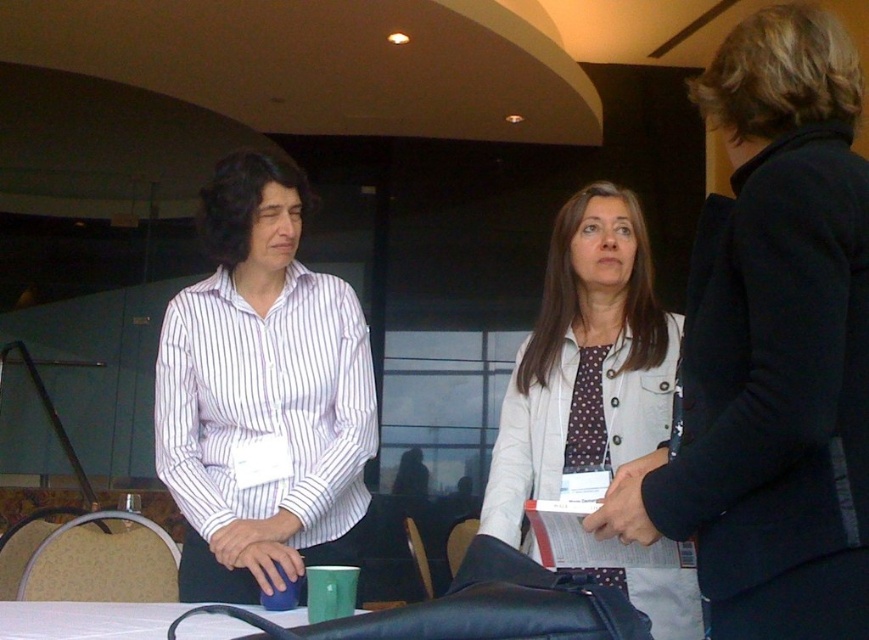
Is white textured jacket at center to the right of white glossy table at lower center from the viewer's perspective?

Correct, you'll find white textured jacket at center to the right of white glossy table at lower center.

Is point (549, 401) more distant than point (25, 628)?

That is True.

Locate an element on the screen. This screenshot has width=869, height=640. white textured jacket at center is located at coordinates (584, 362).